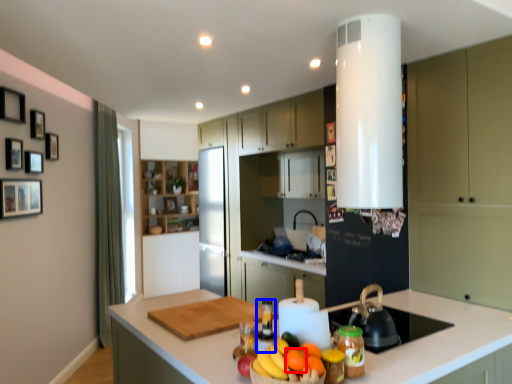
Question: Which point is further to the camera, orange (highlighted by a red box) or bottle (highlighted by a blue box)?

Choices:
 (A) orange
 (B) bottle

Answer: (B)